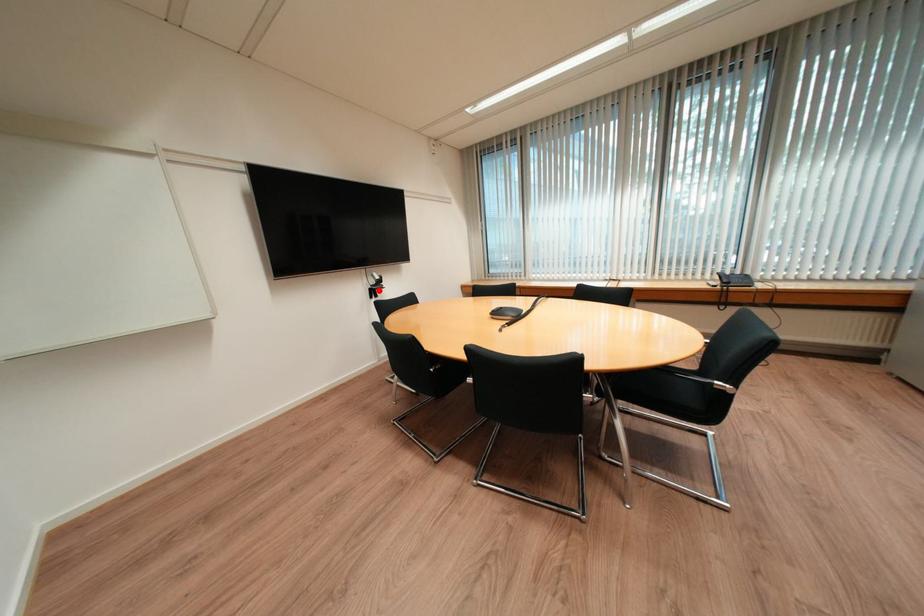
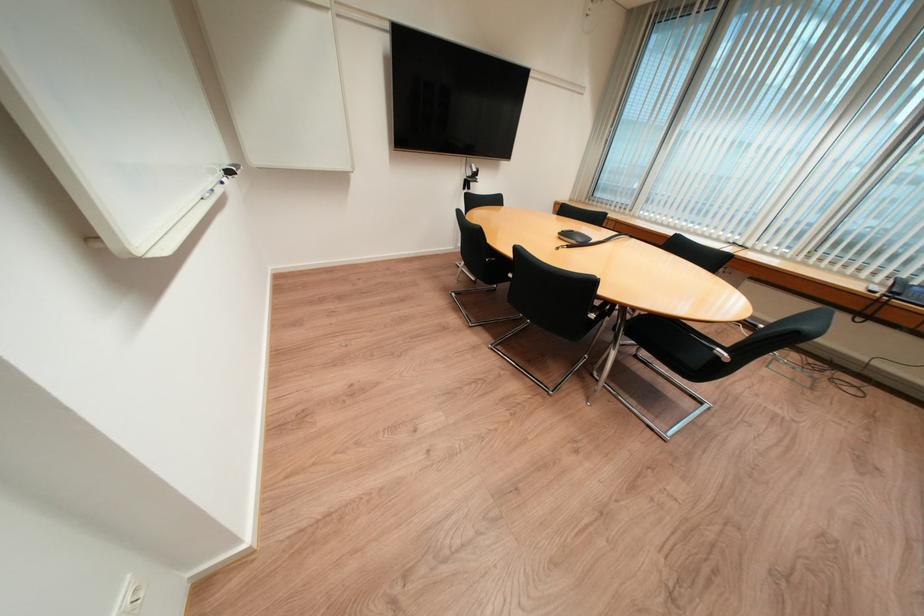
Locate, in the second image, the point that corresponds to the highlighted location in the first image.

(473, 182)